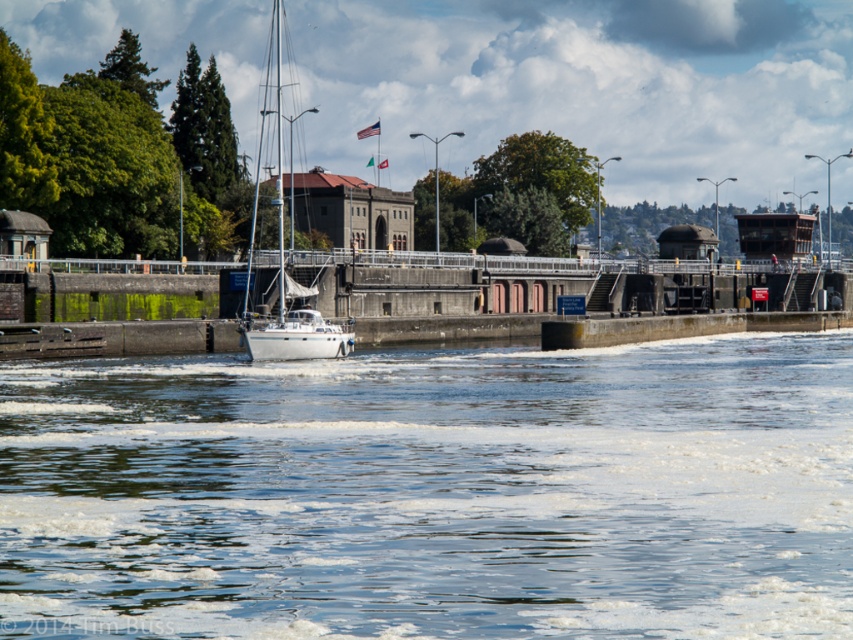
Is clear water at center thinner than white matte sailboat at center?

No.

Who is positioned more to the left, clear water at center or white matte sailboat at center?

white matte sailboat at center

Is point (346, 440) positioned in front of point (277, 134)?

Yes, point (346, 440) is in front of point (277, 134).

This screenshot has height=640, width=853. In order to click on clear water at center in this screenshot , I will do `click(433, 492)`.